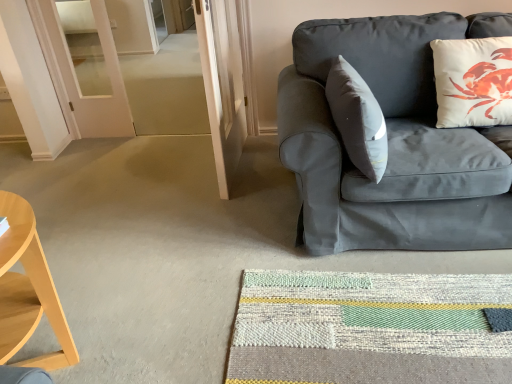
Find the location of `white matte pillow at upper right`. white matte pillow at upper right is located at coordinates (473, 82).

In the scene shown: Considering the relative positions of white matte pillow at upper right and textured woven mat at lower center in the image provided, is white matte pillow at upper right to the right of textured woven mat at lower center from the viewer's perspective?

Yes.

What are the coordinates of `mat in front of the white matte pillow at upper right` in the screenshot? It's located at (368, 328).

In terms of height, does white matte pillow at upper right look taller or shorter compared to textured woven mat at lower center?

Clearly, white matte pillow at upper right is taller compared to textured woven mat at lower center.

You are a GUI agent. You are given a task and a screenshot of the screen. Output one action in this format:
    pyautogui.click(x=<x>, y=<y>)
    Task: Click on the studio couch lying on the right of textured woven mat at lower center
    The image size is (512, 384).
    Given the screenshot: What is the action you would take?
    pyautogui.click(x=391, y=143)

Is textured woven mat at lower center not inside matte gray couch at right?

textured woven mat at lower center is positioned outside matte gray couch at right.

From their relative heights in the image, would you say textured woven mat at lower center is taller or shorter than matte gray couch at right?

Clearly, textured woven mat at lower center is shorter compared to matte gray couch at right.

Based on the photo, is matte gray couch at right far from textured woven mat at lower center?

matte gray couch at right is actually quite close to textured woven mat at lower center.

Which object is positioned more to the right, matte gray couch at right or textured woven mat at lower center?

From the viewer's perspective, matte gray couch at right appears more on the right side.

This screenshot has height=384, width=512. Identify the location of mat below the matte gray couch at right (from a real-world perspective). (368, 328).

Considering the relative sizes of matte gray couch at right and textured woven mat at lower center in the image provided, is matte gray couch at right taller than textured woven mat at lower center?

Correct, matte gray couch at right is much taller as textured woven mat at lower center.

From the image's perspective, is white matte pillow at upper right located above or below light wood/wooden desk at left?

Based on their image positions, white matte pillow at upper right is located above light wood/wooden desk at left.

Do you think white matte pillow at upper right is within light wood/wooden desk at left, or outside of it?

white matte pillow at upper right is not enclosed by light wood/wooden desk at left.

Find the location of a particular element. The image size is (512, 384). pillow above the light wood/wooden desk at left (from a real-world perspective) is located at coordinates [473, 82].

Who is bigger, white matte pillow at upper right or light wood/wooden desk at left?

light wood/wooden desk at left is bigger.

From the picture: What's the angular difference between matte gray couch at right and light wood/wooden desk at left's facing directions?

The angle between the facing direction of matte gray couch at right and the facing direction of light wood/wooden desk at left is 87.5 degrees.

Which object is closer to the camera, matte gray couch at right or light wood/wooden desk at left?

light wood/wooden desk at left is more forward.

Between matte gray couch at right and light wood/wooden desk at left, which one has smaller size?

light wood/wooden desk at left is smaller.

From the image's perspective, which one is positioned higher, matte gray couch at right or light wood/wooden desk at left?

matte gray couch at right, from the image's perspective.

Looking at this image, is light wood/wooden desk at left oriented away from white matte pillow at upper right?

light wood/wooden desk at left is not turned away from white matte pillow at upper right.

Are light wood/wooden desk at left and white matte pillow at upper right located far from each other?

light wood/wooden desk at left is far away from white matte pillow at upper right.

Between light wood/wooden desk at left and white matte pillow at upper right, which one is positioned in front?

Positioned in front is light wood/wooden desk at left.

Is light wood/wooden desk at left completely or partially outside of white matte pillow at upper right?

light wood/wooden desk at left lies outside white matte pillow at upper right's area.

Is point (386, 236) farther from camera compared to point (467, 75)?

No, it is not.

Could white matte pillow at upper right be considered to be inside matte gray couch at right?

Yes.

Which of these two, matte gray couch at right or white matte pillow at upper right, is thinner?

Thinner between the two is white matte pillow at upper right.

Is matte gray couch at right with white matte pillow at upper right?

matte gray couch at right and white matte pillow at upper right are not in contact.

This screenshot has width=512, height=384. I want to click on pillow behind the textured woven mat at lower center, so click(x=473, y=82).

Find the location of a particular element. The width and height of the screenshot is (512, 384). studio couch located on the right of textured woven mat at lower center is located at coordinates (391, 143).

Looking at the image, which one is located closer to matte gray couch at right, white matte pillow at upper right or light wood/wooden desk at left?

white matte pillow at upper right.

Considering their positions, is matte gray couch at right positioned further to white matte pillow at upper right than textured woven mat at lower center?

Among the two, textured woven mat at lower center is located further to white matte pillow at upper right.

Based on their spatial positions, is matte gray couch at right or light wood/wooden desk at left further from textured woven mat at lower center?

Among the two, light wood/wooden desk at left is located further to textured woven mat at lower center.

Estimate the real-world distances between objects in this image. Which object is closer to light wood/wooden desk at left, white matte pillow at upper right or textured woven mat at lower center?

textured woven mat at lower center lies closer to light wood/wooden desk at left than the other object.

Which object lies further to the anchor point textured woven mat at lower center, matte gray couch at right or white matte pillow at upper right?

Based on the image, white matte pillow at upper right appears to be further to textured woven mat at lower center.

From the image, which object appears to be farther from light wood/wooden desk at left, textured woven mat at lower center or matte gray couch at right?

Based on the image, matte gray couch at right appears to be further to light wood/wooden desk at left.

Looking at the image, which one is located further to matte gray couch at right, light wood/wooden desk at left or textured woven mat at lower center?

light wood/wooden desk at left is positioned further to the anchor matte gray couch at right.

Looking at the image, which one is located closer to matte gray couch at right, white matte pillow at upper right or textured woven mat at lower center?

white matte pillow at upper right lies closer to matte gray couch at right than the other object.

Find the location of a particular element. The width and height of the screenshot is (512, 384). mat between light wood/wooden desk at left and matte gray couch at right in the horizontal direction is located at coordinates (368, 328).

Where is `studio couch between white matte pillow at upper right and textured woven mat at lower center in the vertical direction`? The image size is (512, 384). studio couch between white matte pillow at upper right and textured woven mat at lower center in the vertical direction is located at coordinates (391, 143).

Locate an element on the screen. This screenshot has width=512, height=384. mat located between light wood/wooden desk at left and white matte pillow at upper right in the left-right direction is located at coordinates (368, 328).

Identify the location of studio couch between light wood/wooden desk at left and white matte pillow at upper right from left to right. The height and width of the screenshot is (384, 512). (391, 143).